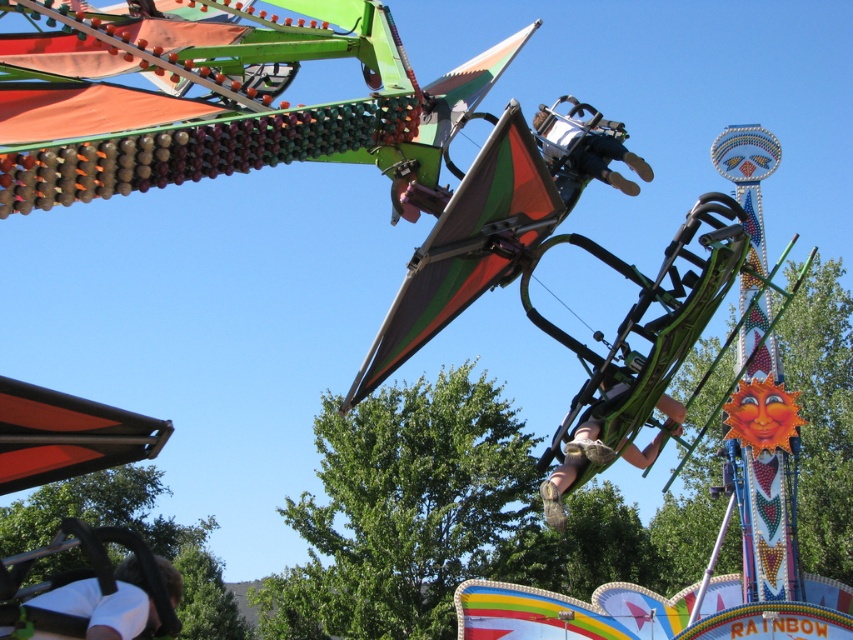
Question: Estimate the real-world distances between objects in this image. Which object is closer to the green fabric seat at center?

Choices:
 (A) white matte shirt at lower left
 (B) matte black helmet at center

Answer: (B)

Question: In this image, where is green fabric seat at center located relative to matte black helmet at center?

Choices:
 (A) above
 (B) below

Answer: (B)

Question: Which object is farther from the camera taking this photo?

Choices:
 (A) matte black helmet at center
 (B) green fabric seat at center

Answer: (A)

Question: Is white matte shirt at lower left above green fabric seat at center?

Choices:
 (A) no
 (B) yes

Answer: (A)

Question: Which object appears farthest from the camera in this image?

Choices:
 (A) matte black helmet at center
 (B) white matte shirt at lower left

Answer: (A)

Question: Can you confirm if white matte shirt at lower left is positioned to the left of matte black helmet at center?

Choices:
 (A) yes
 (B) no

Answer: (A)